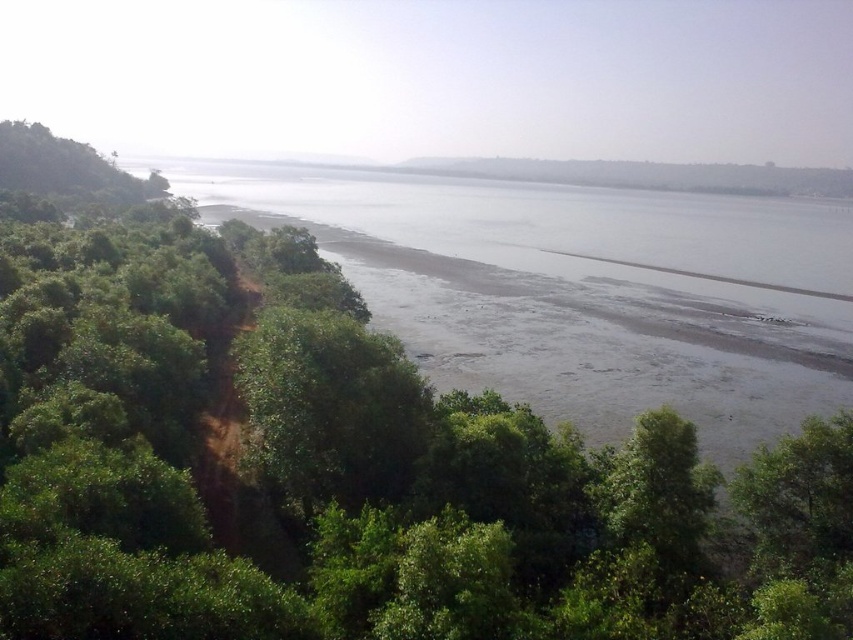
Is greenish-gray mudflat at lower center shorter than green grassy hillside at center?

No.

The height and width of the screenshot is (640, 853). Find the location of `greenish-gray mudflat at lower center`. greenish-gray mudflat at lower center is located at coordinates (578, 289).